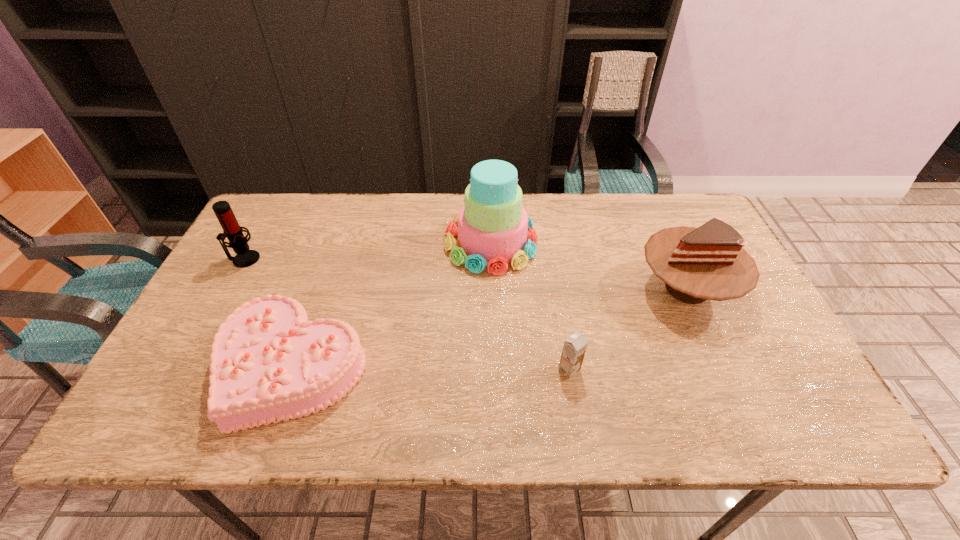
Locate an element on the screen. This screenshot has height=540, width=960. free space located 0.110m on the back of the leftmost object is located at coordinates (261, 227).

You are a GUI agent. You are given a task and a screenshot of the screen. Output one action in this format:
    pyautogui.click(x=<x>, y=<y>)
    Task: Click on the free space located on the left of the rightmost object
    
    Given the screenshot: What is the action you would take?
    pyautogui.click(x=610, y=289)

You are a GUI agent. You are given a task and a screenshot of the screen. Output one action in this format:
    pyautogui.click(x=<x>, y=<y>)
    Task: Click on the free space located 0.160m on the left of the chocolate milk
    The width and height of the screenshot is (960, 540).
    Given the screenshot: What is the action you would take?
    pyautogui.click(x=489, y=369)

At what (x,y) coordinates should I click in order to perform the action: click on free space located on the back of the shortest cake. Please return your answer as a coordinate pair (x, y). Image resolution: width=960 pixels, height=540 pixels. Looking at the image, I should click on (327, 270).

You are a GUI agent. You are given a task and a screenshot of the screen. Output one action in this format:
    pyautogui.click(x=<x>, y=<y>)
    Task: Click on the object that is at the far edge
    The height and width of the screenshot is (540, 960).
    Given the screenshot: What is the action you would take?
    pyautogui.click(x=492, y=231)

The height and width of the screenshot is (540, 960). In order to click on object that is at the near edge in this screenshot , I will do `click(269, 363)`.

Find the location of a particular element. microphone that is at the left edge is located at coordinates (231, 229).

Where is `cake that is positioned at the left edge`? The width and height of the screenshot is (960, 540). cake that is positioned at the left edge is located at coordinates (269, 363).

Identify the location of object present at the right edge. Image resolution: width=960 pixels, height=540 pixels. (709, 262).

Where is `object that is at the near left corner`? The width and height of the screenshot is (960, 540). object that is at the near left corner is located at coordinates (269, 363).